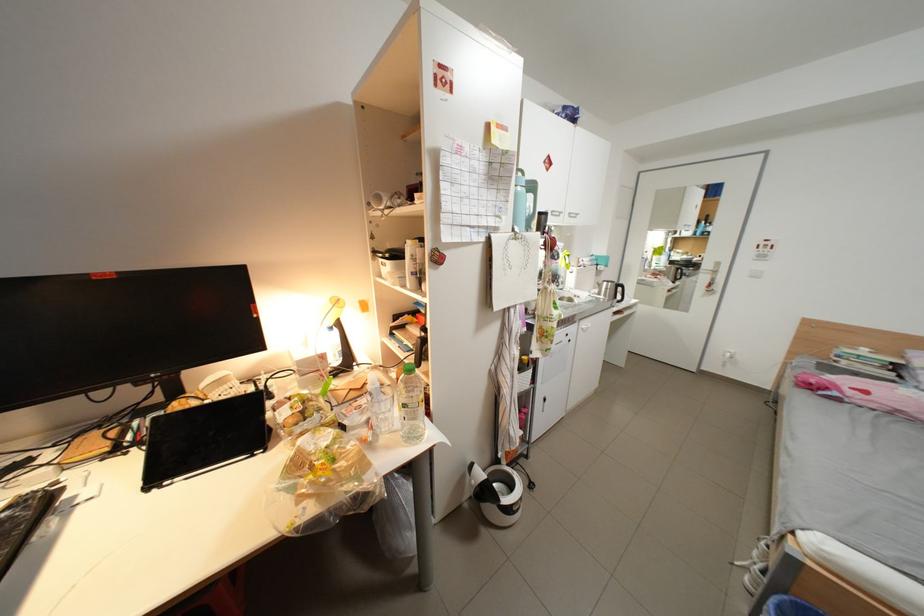
Locate an element on the screen. This screenshot has height=616, width=924. faucet handle is located at coordinates (582, 301).